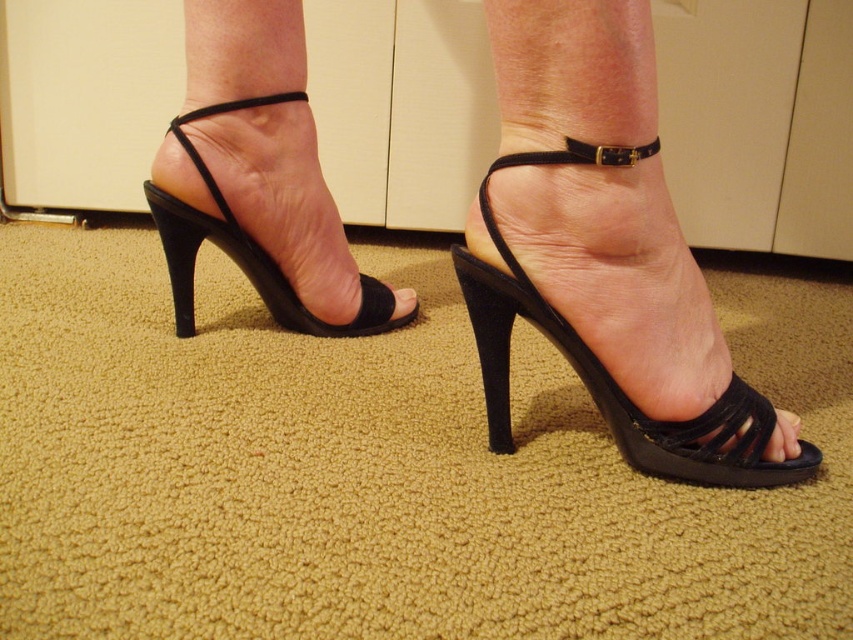
You are a photographer setting up a shot of the suede black sandal at center. The camera is positioned 21.07 inches away from the sandal. If you want to capture the entire sandal in the frame without moving the camera, what adjustment should you make?

To capture the entire suede black sandal at center without moving the camera, you should use a wider angle lens since the camera is currently positioned 21.07 inches away from the sandal.

You are a photographer adjusting your camera to focus on two points in the image of the feet wearing black high heels. The points are labeled as point [596,193] and point [670,468]. Which point should you focus on first to ensure the closest object is sharp?

Point [596,193] is closer to the viewer than point [670,468], so you should focus on point [596,193] first to ensure the closest object is sharp.